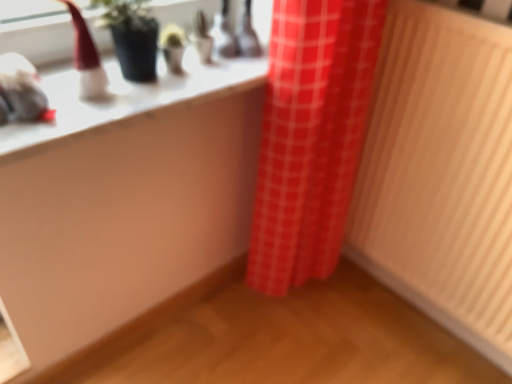
You are a GUI agent. You are given a task and a screenshot of the screen. Output one action in this format:
    pyautogui.click(x=<x>, y=<y>)
    Task: Click on the white glossy counter top at upper left
    The image size is (512, 384).
    Given the screenshot: What is the action you would take?
    pyautogui.click(x=127, y=96)

The width and height of the screenshot is (512, 384). I want to click on wooden radiator at right, so click(441, 173).

This screenshot has width=512, height=384. Describe the element at coordinates (441, 173) in the screenshot. I see `wooden radiator at right` at that location.

You are a GUI agent. You are given a task and a screenshot of the screen. Output one action in this format:
    pyautogui.click(x=<x>, y=<y>)
    Task: Click on the red checkered curtain at center
    The image size is (512, 384).
    Given the screenshot: What is the action you would take?
    pyautogui.click(x=311, y=136)

I want to click on white glossy counter top at upper left, so click(127, 96).

Measure the distance from wooden radiator at right to white glossy counter top at upper left.

They are 27.34 inches apart.

Which object is thinner, wooden radiator at right or white glossy counter top at upper left?

wooden radiator at right is thinner.

Which of these two, wooden radiator at right or white glossy counter top at upper left, is bigger?

wooden radiator at right.

Is wooden radiator at right facing away from white glossy counter top at upper left?

wooden radiator at right does not have its back to white glossy counter top at upper left.

Does wooden radiator at right contain red checkered curtain at center?

That's incorrect, red checkered curtain at center is not inside wooden radiator at right.

Is wooden radiator at right further to the viewer compared to red checkered curtain at center?

No, the depth of wooden radiator at right is less than that of red checkered curtain at center.

Is wooden radiator at right turned away from red checkered curtain at center?

No, wooden radiator at right is not facing away from red checkered curtain at center.

Based on their positions, is red checkered curtain at center located to the left or right of white glossy counter top at upper left?

Based on their positions, red checkered curtain at center is located to the right of white glossy counter top at upper left.

From the picture: Can white glossy counter top at upper left be found inside red checkered curtain at center?

No, white glossy counter top at upper left is not a part of red checkered curtain at center.

In the image, is red checkered curtain at center positioned in front of or behind white glossy counter top at upper left?

red checkered curtain at center is behind white glossy counter top at upper left.

Which is behind, red checkered curtain at center or wooden radiator at right?

red checkered curtain at center is more distant.

From the image's perspective, which one is positioned lower, red checkered curtain at center or wooden radiator at right?

From the image's view, wooden radiator at right is below.

Can you confirm if red checkered curtain at center is shorter than wooden radiator at right?

Yes.

Is red checkered curtain at center wider or thinner than wooden radiator at right?

Clearly, red checkered curtain at center has more width compared to wooden radiator at right.

Considering the sizes of objects white glossy counter top at upper left and red checkered curtain at center in the image provided, who is wider, white glossy counter top at upper left or red checkered curtain at center?

With larger width is white glossy counter top at upper left.

From the image's perspective, relative to red checkered curtain at center, is white glossy counter top at upper left above or below?

From the image's perspective, white glossy counter top at upper left appears above red checkered curtain at center.

From a real-world perspective, is white glossy counter top at upper left positioned over red checkered curtain at center based on gravity?

Yes, from a real-world perspective, white glossy counter top at upper left is on top of red checkered curtain at center.

Can you tell me how much white glossy counter top at upper left and red checkered curtain at center differ in facing direction?

0.514 degrees.

From a real-world perspective, is white glossy counter top at upper left physically located above or below wooden radiator at right?

white glossy counter top at upper left is situated higher than wooden radiator at right in the real world.

From the image's perspective, which one is positioned lower, white glossy counter top at upper left or wooden radiator at right?

From the image's view, wooden radiator at right is below.

Is point (191, 67) farther from viewer compared to point (484, 229)?

That is False.

Find the location of `counter top above the wooden radiator at right (from a real-world perspective)`. counter top above the wooden radiator at right (from a real-world perspective) is located at coordinates (127, 96).

Where is `radiator below the red checkered curtain at center (from a real-world perspective)`? The width and height of the screenshot is (512, 384). radiator below the red checkered curtain at center (from a real-world perspective) is located at coordinates (441, 173).

Which object lies nearer to the anchor point wooden radiator at right, white glossy counter top at upper left or red checkered curtain at center?

Among the two, red checkered curtain at center is located nearer to wooden radiator at right.

When comparing their distances from white glossy counter top at upper left, does wooden radiator at right or red checkered curtain at center seem closer?

red checkered curtain at center is positioned closer to the anchor white glossy counter top at upper left.

When comparing their distances from wooden radiator at right, does red checkered curtain at center or white glossy counter top at upper left seem further?

white glossy counter top at upper left lies further to wooden radiator at right than the other object.

Estimate the real-world distances between objects in this image. Which object is further from red checkered curtain at center, wooden radiator at right or white glossy counter top at upper left?

Among the two, white glossy counter top at upper left is located further to red checkered curtain at center.

Which object lies further to the anchor point white glossy counter top at upper left, red checkered curtain at center or wooden radiator at right?

The object further to white glossy counter top at upper left is wooden radiator at right.

Based on their spatial positions, is white glossy counter top at upper left or wooden radiator at right closer to red checkered curtain at center?

wooden radiator at right is closer to red checkered curtain at center.

Identify the location of curtain located between white glossy counter top at upper left and wooden radiator at right in the left-right direction. (311, 136).